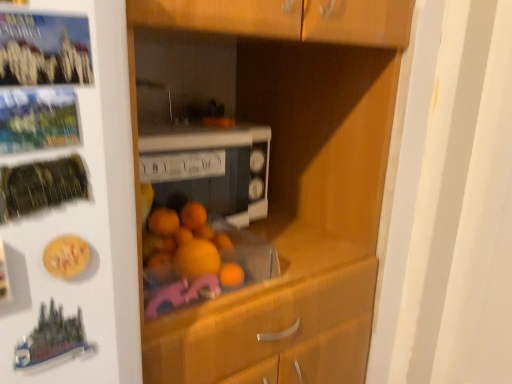
Question: Is white glossy microwave at center facing away from metallic silver button at upper left?

Choices:
 (A) yes
 (B) no

Answer: (B)

Question: Is white glossy microwave at center not close to metallic silver button at upper left?

Choices:
 (A) no
 (B) yes

Answer: (A)

Question: Does white glossy microwave at center turn towards metallic silver button at upper left?

Choices:
 (A) no
 (B) yes

Answer: (A)

Question: Does white glossy microwave at center lie behind metallic silver button at upper left?

Choices:
 (A) yes
 (B) no

Answer: (A)

Question: Is white glossy microwave at center in front of metallic silver button at upper left?

Choices:
 (A) no
 (B) yes

Answer: (A)

Question: Could metallic silver button at upper left be considered to be inside white glossy microwave at center?

Choices:
 (A) no
 (B) yes

Answer: (A)

Question: Can you confirm if metallic silver button at upper left is wider than white glossy microwave at center?

Choices:
 (A) no
 (B) yes

Answer: (A)

Question: Is metallic silver button at upper left bigger than white glossy microwave at center?

Choices:
 (A) no
 (B) yes

Answer: (A)

Question: Is white glossy microwave at center at the back of metallic silver button at upper left?

Choices:
 (A) yes
 (B) no

Answer: (B)

Question: Does metallic silver button at upper left have a lesser width compared to white glossy microwave at center?

Choices:
 (A) no
 (B) yes

Answer: (B)

Question: Is metallic silver button at upper left at the right side of white glossy microwave at center?

Choices:
 (A) yes
 (B) no

Answer: (B)

Question: Is white glossy microwave at center a part of metallic silver button at upper left?

Choices:
 (A) no
 (B) yes

Answer: (A)

Question: In the image, is white glossy microwave at center on the left side or the right side of metallic silver button at upper left?

Choices:
 (A) right
 (B) left

Answer: (A)